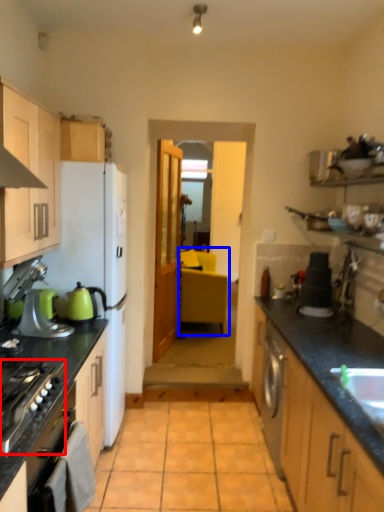
Question: Which of the following is the farthest to the observer, home appliance (highlighted by a red box) or chair (highlighted by a blue box)?

Choices:
 (A) home appliance
 (B) chair

Answer: (B)